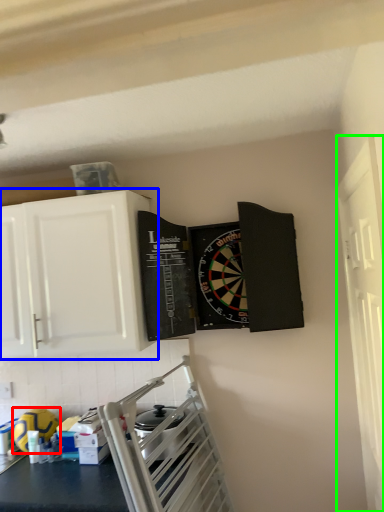
Question: Which object is the closest to the appliance (highlighted by a red box)? Choose among these: cabinetry (highlighted by a blue box) or window (highlighted by a green box).

Choices:
 (A) cabinetry
 (B) window

Answer: (A)